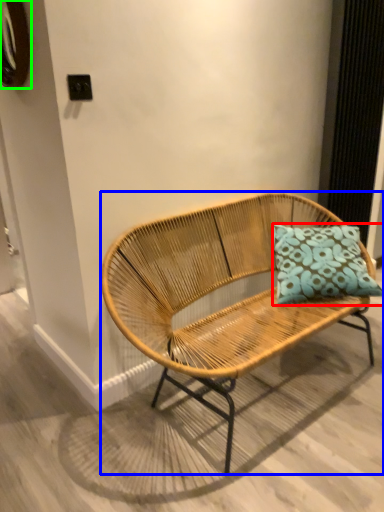
Question: Which is farther away from pillow (highlighted by a red box)? bench (highlighted by a blue box) or oval (highlighted by a green box)?

Choices:
 (A) bench
 (B) oval

Answer: (B)